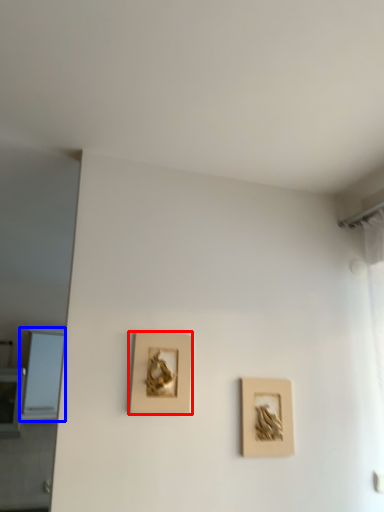
Question: Which of the following is the closest to the observer, picture frame (highlighted by a red box) or window (highlighted by a blue box)?

Choices:
 (A) picture frame
 (B) window

Answer: (A)